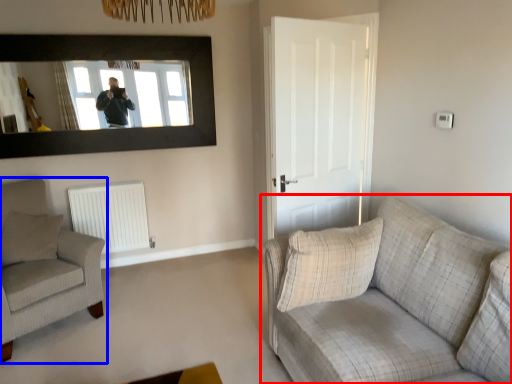
Question: Which point is further to the camera, studio couch (highlighted by a red box) or chair (highlighted by a blue box)?

Choices:
 (A) studio couch
 (B) chair

Answer: (B)